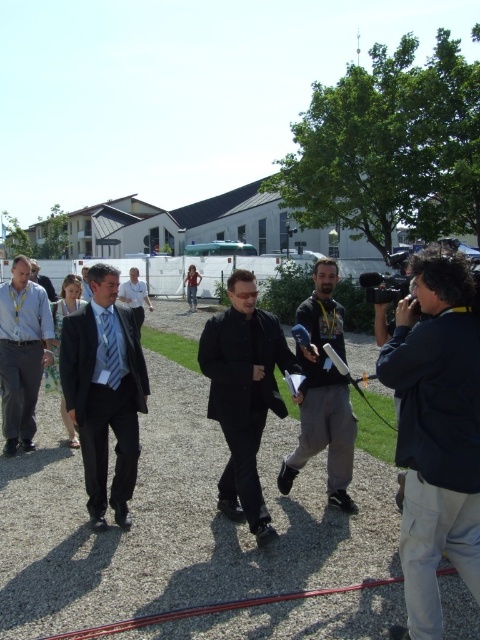
Question: Which of these objects is positioned closest to the light blue suit at center?

Choices:
 (A) black matte jacket at center
 (B) dark gray fabric jacket at center
 (C) dark blue jacket at right
 (D) light blue fabric suit at center

Answer: (D)

Question: Is light blue fabric suit at center above light blue suit at center?

Choices:
 (A) yes
 (B) no

Answer: (B)

Question: Which is farther from the black matte jacket at center?

Choices:
 (A) dark gray fabric jacket at center
 (B) matte black suit at left

Answer: (B)

Question: Does dark gray fabric jacket at center come behind light blue fabric suit at center?

Choices:
 (A) yes
 (B) no

Answer: (B)

Question: Is the position of dark gray fabric jacket at center more distant than that of light blue suit at center?

Choices:
 (A) no
 (B) yes

Answer: (A)

Question: Which object is farther from the camera taking this photo?

Choices:
 (A) light blue fabric suit at center
 (B) dark gray fabric jacket at center
 (C) matte blue suit at left

Answer: (C)